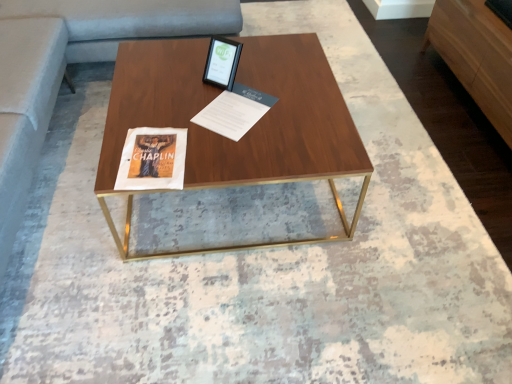
Identify the location of vacant space in front of walnut wood coffee table at center. Image resolution: width=512 pixels, height=384 pixels. click(x=230, y=309).